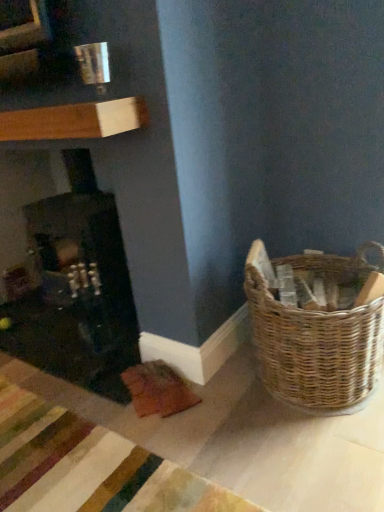
I want to click on free spot in front of woven brown basket at lower right, so click(304, 461).